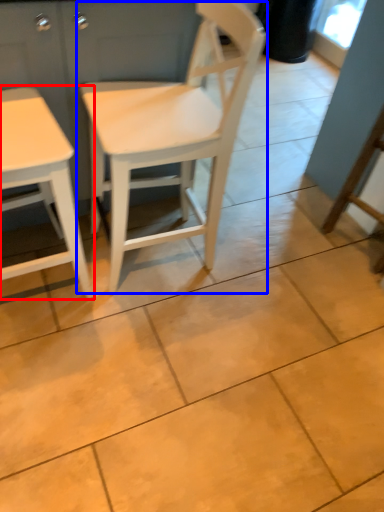
Question: Which object is further to the camera taking this photo, table (highlighted by a red box) or chair (highlighted by a blue box)?

Choices:
 (A) table
 (B) chair

Answer: (B)